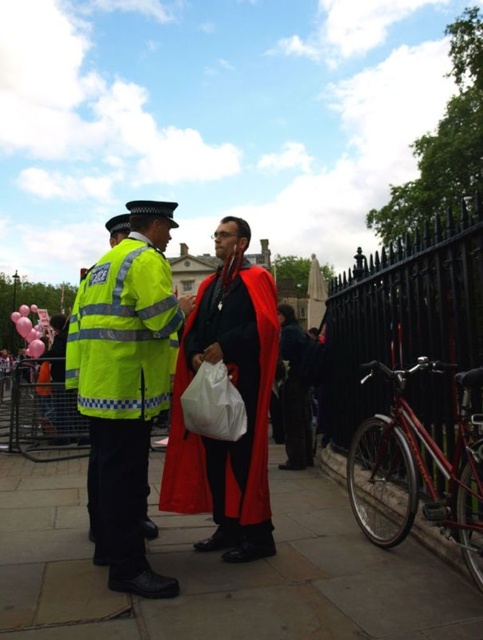
Question: Estimate the real-world distances between objects in this image. Which object is closer to the velvet-like red cape at center?

Choices:
 (A) black wrought iron fence at right
 (B) high visibility yellow jacket at left
 (C) red velvet cape at center

Answer: (B)

Question: Which of these objects is positioned closest to the red velvet cape at center?

Choices:
 (A) slate gray stone pavement at center
 (B) black wrought iron fence at right
 (C) high visibility yellow jacket at left

Answer: (B)

Question: Which of the following is the farthest from the observer?

Choices:
 (A) velvet-like red cape at center
 (B) slate gray stone pavement at center
 (C) black wrought iron fence at right

Answer: (A)

Question: Observing the image, what is the correct spatial positioning of black wrought iron fence at right in reference to red velvet cape at center?

Choices:
 (A) right
 (B) left

Answer: (A)

Question: Is slate gray stone pavement at center wider than red velvet cape at center?

Choices:
 (A) no
 (B) yes

Answer: (B)

Question: Does high visibility yellow jacket at left appear under red velvet cape at center?

Choices:
 (A) no
 (B) yes

Answer: (B)